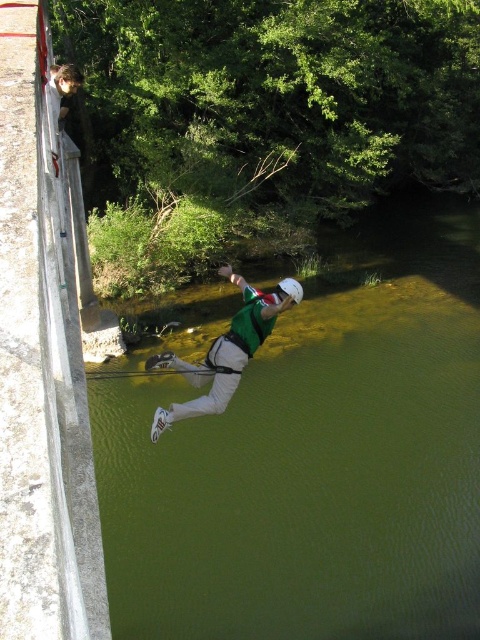
Does point (336, 305) come farther from viewer compared to point (276, 289)?

Yes, it is.

Which is more to the right, green smooth water at center or green fabric person at center?

Positioned to the right is green smooth water at center.

The width and height of the screenshot is (480, 640). Find the location of `green smooth water at center`. green smooth water at center is located at coordinates (315, 458).